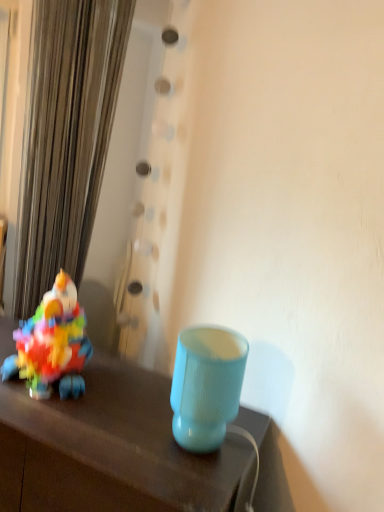
I want to click on empty space that is ontop of matte plastic lamp at lower right (from a real-world perspective), so (x=101, y=403).